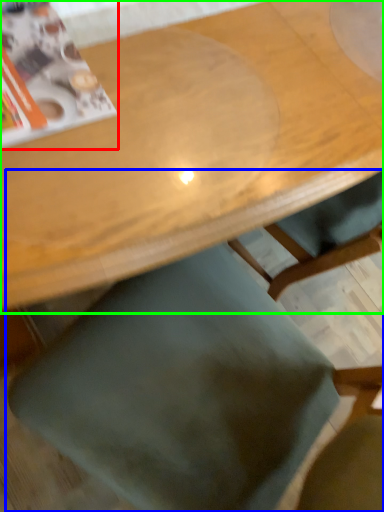
Question: Which object is the farthest from magazine (highlighted by a red box)? Choose among these: chair (highlighted by a blue box) or table (highlighted by a green box).

Choices:
 (A) chair
 (B) table

Answer: (A)